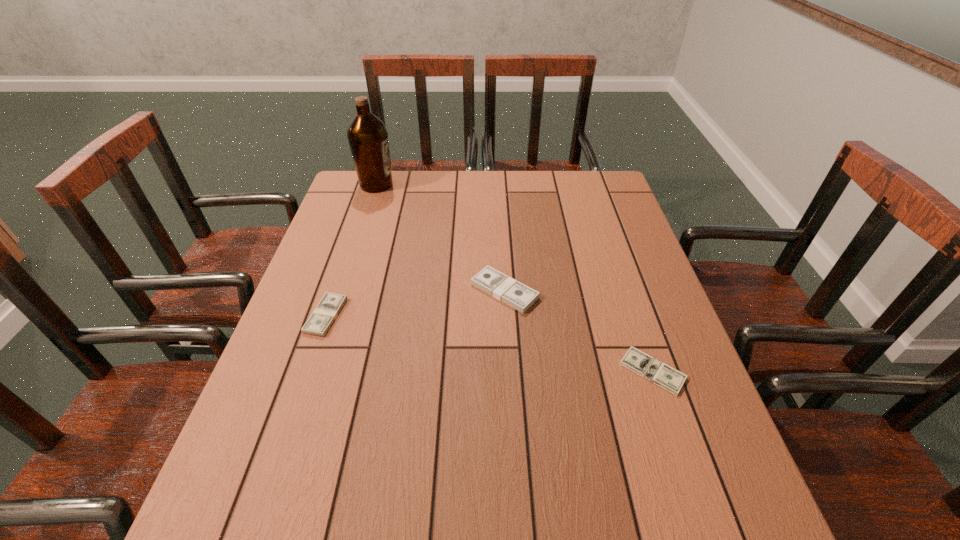
At what (x,y) coordinates should I click in order to perform the action: click on vacant space located on the front of the leftmost dollar. Please return your answer as a coordinate pair (x, y). Looking at the image, I should click on (300, 390).

The width and height of the screenshot is (960, 540). In order to click on blank space located 0.170m on the front of the shortest dollar in this screenshot , I will do `click(689, 480)`.

The height and width of the screenshot is (540, 960). In order to click on object present at the far edge in this screenshot , I will do (367, 135).

Where is `olive oil that is positioned at the left edge`? The width and height of the screenshot is (960, 540). olive oil that is positioned at the left edge is located at coordinates (367, 135).

Where is `dollar present at the left edge`? The image size is (960, 540). dollar present at the left edge is located at coordinates click(330, 305).

In order to click on object positioned at the right edge in this screenshot , I will do `click(661, 374)`.

The image size is (960, 540). Identify the location of object that is at the far left corner. (367, 135).

Image resolution: width=960 pixels, height=540 pixels. In the image, there is a desktop. Find the location of `vacant space at the far edge`. vacant space at the far edge is located at coordinates (536, 172).

Locate an element on the screen. The height and width of the screenshot is (540, 960). free space at the near edge of the desktop is located at coordinates (465, 533).

I want to click on free space at the left edge of the desktop, so click(x=368, y=211).